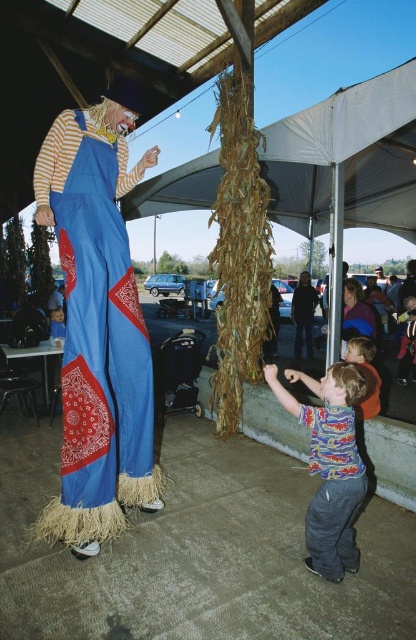
You are organizing a costume party and need to decide which of the two blue items, the blue straw scarecrow at left or the matte blue shirt at center, would be more suitable for a centerpiece decoration. Based on their sizes, which one would you choose?

The blue straw scarecrow at left has a larger size compared to the matte blue shirt at center, so it would be more suitable for a centerpiece decoration due to its bigger size.

You are standing at the center of the image. Which object is closer to the top edge of the image, the blue straw scarecrow at left or the person on stilts?

The blue straw scarecrow at left is closer to the top edge of the image because its 2D location at point 0.236 on the y axis is closer to 0 than the person on stilts.